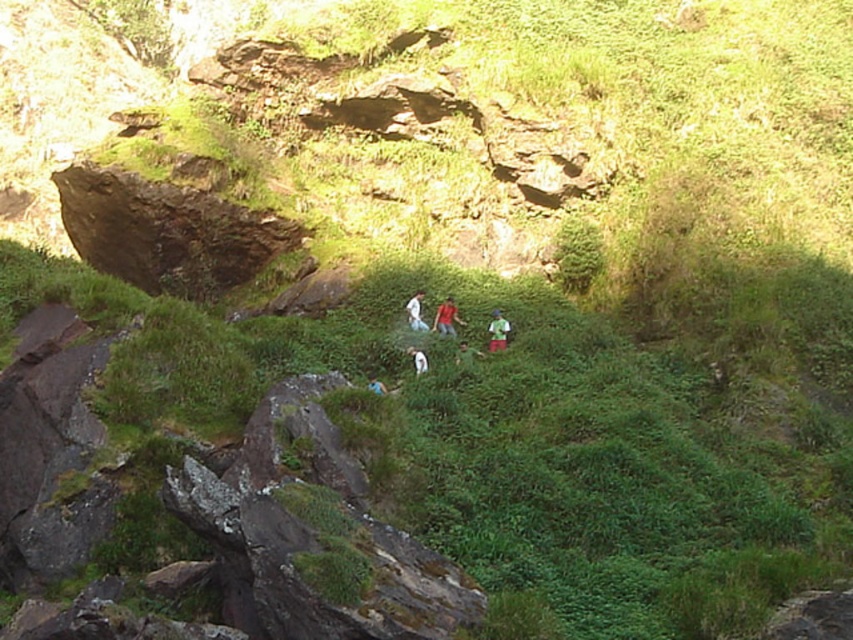
Question: Does green fabric person at center have a lesser width compared to white matte shirt at center?

Choices:
 (A) no
 (B) yes

Answer: (B)

Question: Which point is closer to the camera taking this photo?

Choices:
 (A) (473, 358)
 (B) (416, 314)
 (C) (440, 307)

Answer: (A)

Question: Where is green fabric shirt at center located in relation to white matte dog at center in the image?

Choices:
 (A) left
 (B) right

Answer: (B)

Question: Which object appears farthest from the camera in this image?

Choices:
 (A) blue fabric person at center
 (B) green fabric person at center
 (C) white matte shirt at center

Answer: (C)

Question: Does red fabric shirt at center have a lesser width compared to white matte shirt at center?

Choices:
 (A) yes
 (B) no

Answer: (B)

Question: Which point appears closest to the camera in this image?

Choices:
 (A) (384, 388)
 (B) (469, 346)
 (C) (496, 348)
 (D) (440, 316)

Answer: (A)